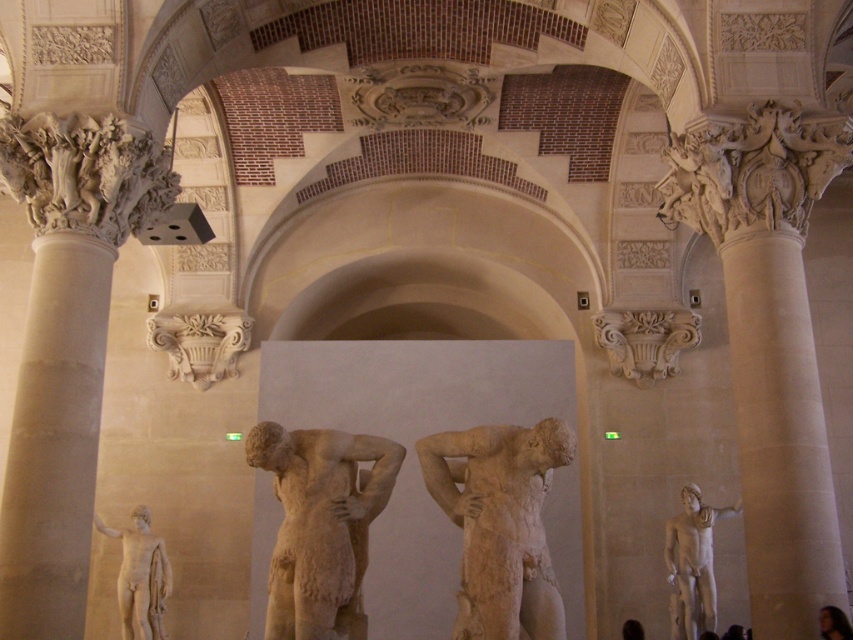
You are an art conservator tasked with moving a 35 meter long protective cover from the smooth skin figure at center to the carved stone ornament at upper right. Can you determine if the cover will reach the ornament?

The distance between the carved stone ornament at upper right and the smooth skin figure at center is 35.15 meters. The protective cover is 35 meters long, so it will fall short by 0.15 meters and cannot fully reach the ornament.

You are standing in the museum and want to take a photo of the white marble column at right. If your camera has a maximum zoom range of 40 meters, can you capture the entire column in the photo without moving closer?

The white marble column at right is 43.35 meters away from the viewer. Since the camera can only zoom up to 40 meters, you cannot capture the entire column without moving closer.